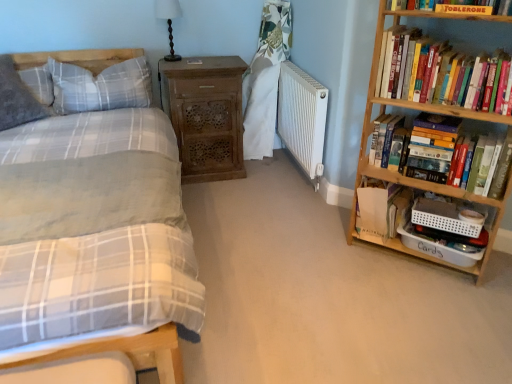
Find the location of a particular element. This screenshot has width=512, height=384. free space in front of white fabric curtain at center is located at coordinates (267, 169).